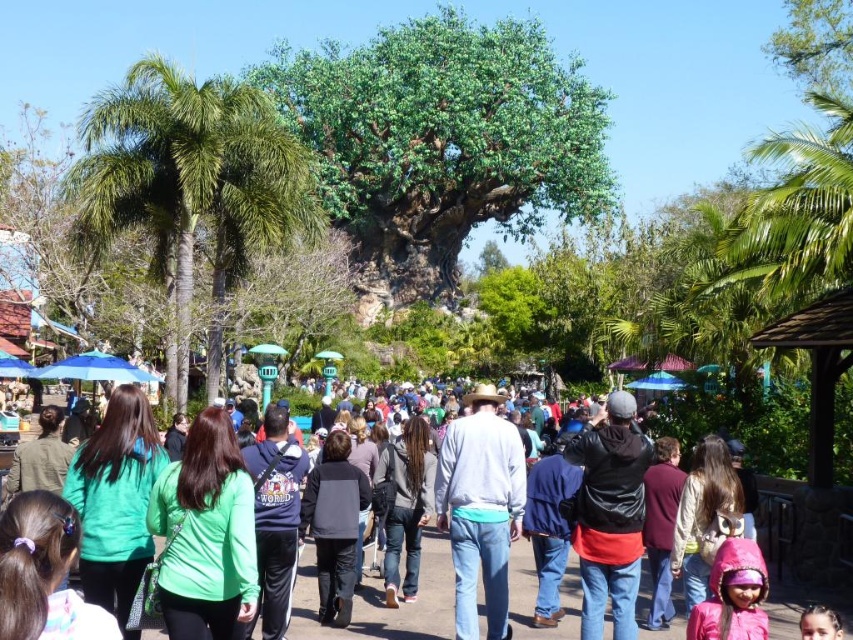
Question: Which object is positioned farthest from the dark gray jacket at center?

Choices:
 (A) green fabric jacket at lower left
 (B) green leafy palm tree at left
 (C) green leafy tree at center
 (D) light gray cotton shirt at center

Answer: (C)

Question: Among these points, which one is farthest from the camera?

Choices:
 (A) (90, 518)
 (B) (525, 196)

Answer: (B)

Question: Can you confirm if pink fleece jacket at lower right is wider than pink fabric at lower right?

Choices:
 (A) yes
 (B) no

Answer: (B)

Question: Observing the image, what is the correct spatial positioning of gray fabric jacket at center in reference to maroon fabric jacket at center-right?

Choices:
 (A) below
 (B) above

Answer: (A)

Question: Which object is positioned farthest from the pink fabric at lower right?

Choices:
 (A) green leafy palm tree at left
 (B) green casual clothing at center
 (C) pink fleece jacket at lower right

Answer: (A)

Question: Can you confirm if green casual clothing at center is positioned above black leather jacket at center?

Choices:
 (A) no
 (B) yes

Answer: (A)